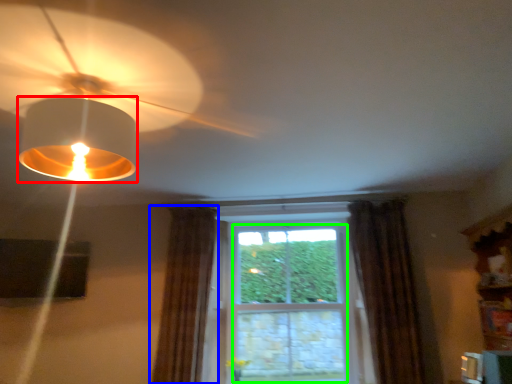
Question: Which object is the farthest from lamp (highlighted by a red box)? Choose among these: curtain (highlighted by a blue box) or bay window (highlighted by a green box).

Choices:
 (A) curtain
 (B) bay window

Answer: (B)